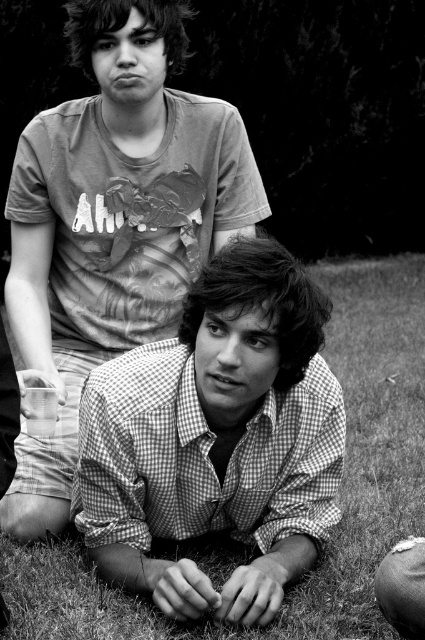
Question: Which of the following is the farthest from the observer?

Choices:
 (A) (118, 198)
 (B) (379, 592)

Answer: (A)

Question: Can you confirm if checkered fabric shirt at lower center is smaller than metallic silver spoon at lower right?

Choices:
 (A) yes
 (B) no

Answer: (B)

Question: Which point is farther to the camera?

Choices:
 (A) grassy lawn at lower center
 (B) checkered fabric shirt at lower center

Answer: (A)

Question: Can you confirm if checkered fabric shirt at lower center is positioned to the right of grassy lawn at lower center?

Choices:
 (A) yes
 (B) no

Answer: (B)

Question: Based on their relative distances, which object is nearer to the metallic silver spoon at lower right?

Choices:
 (A) grassy lawn at lower center
 (B) checkered fabric shirt at lower center

Answer: (B)

Question: Is checkered fabric shirt at lower center below metallic silver spoon at lower right?

Choices:
 (A) yes
 (B) no

Answer: (B)